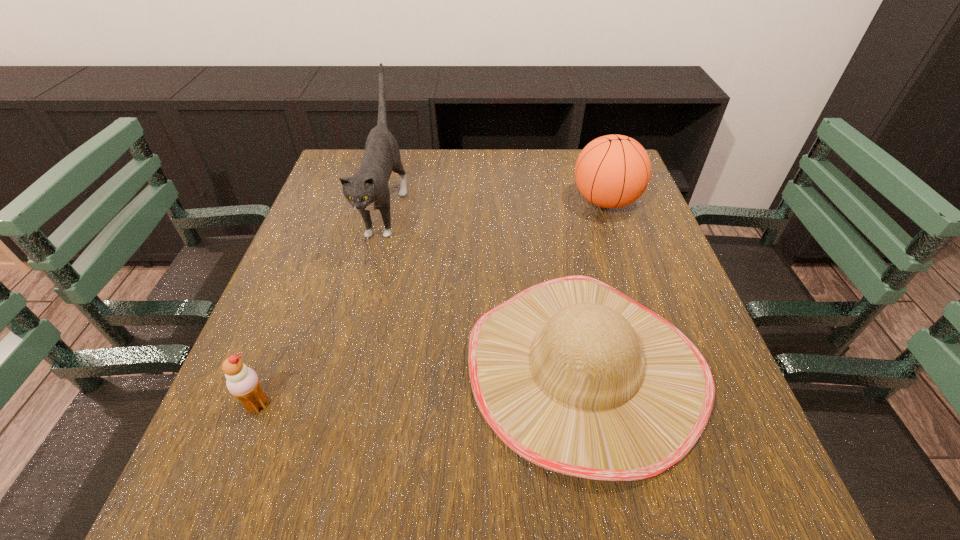
I want to click on vacant space that is in between the icecream and the cat, so click(322, 306).

Where is `the second closest object to the basketball`? The width and height of the screenshot is (960, 540). the second closest object to the basketball is located at coordinates (368, 189).

Select which object appears as the closest to the basketball. Please provide its 2D coordinates. Your answer should be formatted as a tuple, i.e. [(x, y)], where the tuple contains the x and y coordinates of a point satisfying the conditions above.

[(571, 374)]

What are the coordinates of `free space that satisfies the following two spatial constraints: 1. at the face of the second object from left to right; 2. on the left side of the sunhat` in the screenshot? It's located at (345, 367).

Locate an element on the screen. Image resolution: width=960 pixels, height=540 pixels. free region that satisfies the following two spatial constraints: 1. at the face of the cat; 2. on the left side of the sunhat is located at coordinates (345, 367).

Find the location of a particular element. free space that satisfies the following two spatial constraints: 1. at the face of the tallest object; 2. on the left side of the sunhat is located at coordinates (345, 367).

The image size is (960, 540). In order to click on free space in the image that satisfies the following two spatial constraints: 1. at the face of the cat; 2. on the left side of the sunhat in this screenshot , I will do `click(345, 367)`.

You are a GUI agent. You are given a task and a screenshot of the screen. Output one action in this format:
    pyautogui.click(x=<x>, y=<y>)
    Task: Click on the vacant space that satisfies the following two spatial constraints: 1. at the face of the sunhat; 2. on the right side of the cat
    The width and height of the screenshot is (960, 540).
    Given the screenshot: What is the action you would take?
    pyautogui.click(x=345, y=367)